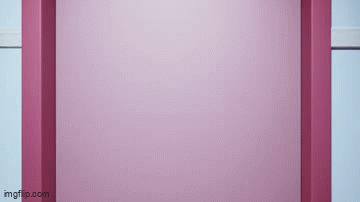
The height and width of the screenshot is (202, 360). Identify the location of door frame. (319, 129).